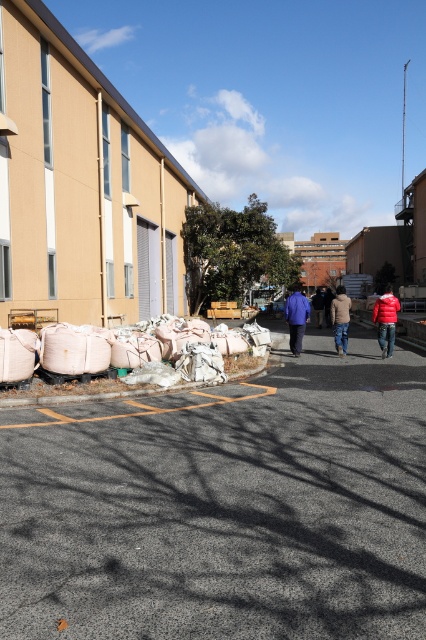
You are standing in the industrial area and need to retrieve an item from the white fabric sacks at lower left. However, there is a person wearing a matte blue jacket at center blocking your path. Can you walk around them to reach the sacks?

The white fabric sacks at lower left are located below the matte blue jacket at center, so the person in the matte blue jacket at center is standing above the sacks. You can walk around them to reach the sacks as they are positioned higher up and not directly blocking the path.

You are standing at the point marked by the coordinates point (138, 348) in the image. What object is located exactly at that point? Please answer with the object label from the scene.

The white fabric sacks at lower left is located at point (138, 348).

Based on the photo, you are a delivery person standing at the entrance of the beige building with vertical pipes. You need to deliver a package to the person wearing the red matte jacket at center and the person wearing the beige wool sweater at center. Which person is closer to you?

The red matte jacket at center is 15.81 feet away from the beige wool sweater at center. Since the distance between them is given, but their individual distances from the delivery person are not specified, it is impossible to determine which one is closer without additional information.